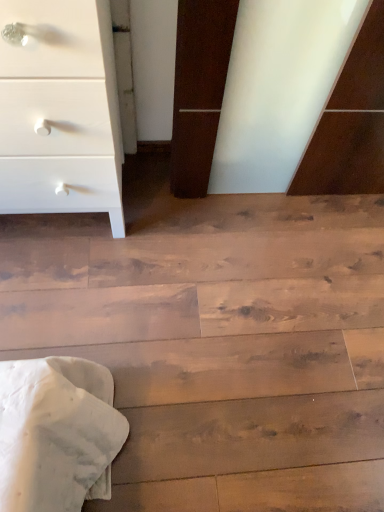
At what (x,y) coordinates should I click in order to perform the action: click on vacant area to the right of white matte chest of drawers at upper left. Please return your answer as a coordinate pair (x, y). Image resolution: width=384 pixels, height=512 pixels. Looking at the image, I should click on (181, 237).